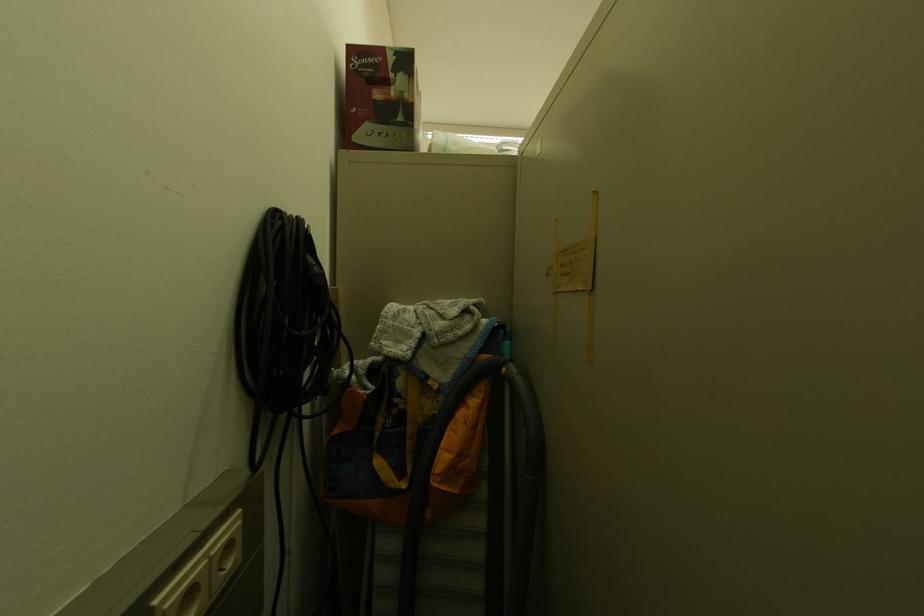
The location [284,317] corresponds to which object?

It corresponds to the coiled black cable in the image.